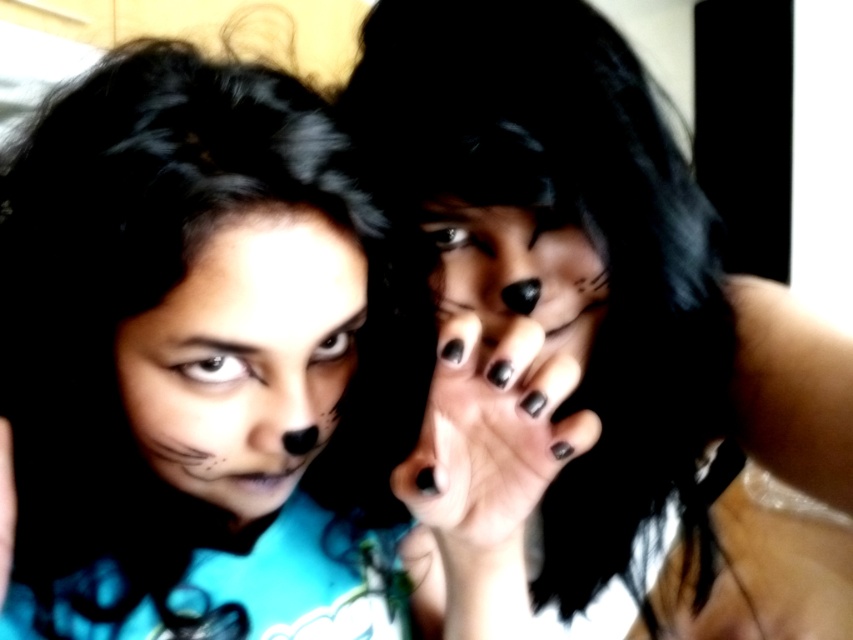
Is point (120, 385) closer to viewer compared to point (434, 452)?

No.

Does matte black face at center have a larger size compared to black matte nails at center?

Correct, matte black face at center is larger in size than black matte nails at center.

Locate an element on the screen. Image resolution: width=853 pixels, height=640 pixels. matte black face at center is located at coordinates (245, 356).

Find the location of a particular element. Image resolution: width=853 pixels, height=640 pixels. matte black face at center is located at coordinates (245, 356).

Is matte black face paint at center further to the viewer compared to matte black nails at center?

No, matte black face paint at center is in front of matte black nails at center.

Which of these two, matte black face paint at center or matte black nails at center, stands shorter?

With less height is matte black nails at center.

Who is more distant from viewer, (556, 374) or (590, 320)?

Positioned behind is point (590, 320).

Where is `matte black face paint at center`? The image size is (853, 640). matte black face paint at center is located at coordinates (231, 381).

Can you confirm if matte black hand at center is bigger than matte black face at center?

Indeed, matte black hand at center has a larger size compared to matte black face at center.

Does matte black hand at center have a greater height compared to matte black face at center?

Yes.

Find the location of a particular element. This screenshot has height=640, width=853. matte black hand at center is located at coordinates (593, 333).

Find the location of a particular element. This screenshot has width=853, height=640. matte black hand at center is located at coordinates point(593,333).